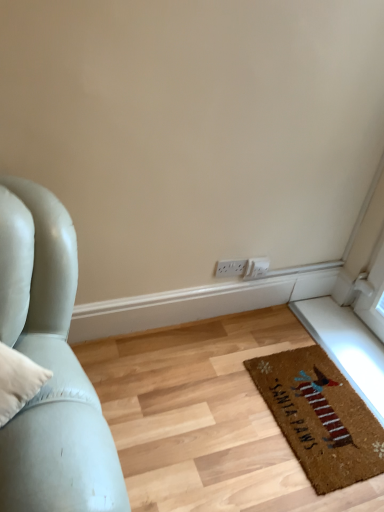
Question: Is white plastic electric outlet at center wider than brown coir mat at lower right?

Choices:
 (A) no
 (B) yes

Answer: (A)

Question: Is white plastic electric outlet at center to the right of brown coir mat at lower right from the viewer's perspective?

Choices:
 (A) no
 (B) yes

Answer: (A)

Question: Can brown coir mat at lower right be found inside white plastic electric outlet at center?

Choices:
 (A) yes
 (B) no

Answer: (B)

Question: Is white plastic electric outlet at center positioned with its back to brown coir mat at lower right?

Choices:
 (A) no
 (B) yes

Answer: (A)

Question: Does white plastic electric outlet at center have a smaller size compared to brown coir mat at lower right?

Choices:
 (A) yes
 (B) no

Answer: (A)

Question: Are white plastic electric outlet at center and brown coir mat at lower right far apart?

Choices:
 (A) no
 (B) yes

Answer: (A)

Question: Considering the relative sizes of brown coir mat at lower right and white plastic electric outlet at center in the image provided, is brown coir mat at lower right thinner than white plastic electric outlet at center?

Choices:
 (A) no
 (B) yes

Answer: (A)

Question: Does brown coir mat at lower right appear on the left side of white plastic electric outlet at center?

Choices:
 (A) no
 (B) yes

Answer: (A)

Question: From the image's perspective, is brown coir mat at lower right below white plastic electric outlet at center?

Choices:
 (A) yes
 (B) no

Answer: (A)

Question: Is white plastic electric outlet at center located within brown coir mat at lower right?

Choices:
 (A) yes
 (B) no

Answer: (B)

Question: Does brown coir mat at lower right appear on the right side of white plastic electric outlet at center?

Choices:
 (A) no
 (B) yes

Answer: (B)

Question: From a real-world perspective, is brown coir mat at lower right on top of white plastic electric outlet at center?

Choices:
 (A) no
 (B) yes

Answer: (A)

Question: Considering the positions of brown coir mat at lower right and white plastic electric outlet at center in the image, is brown coir mat at lower right wider or thinner than white plastic electric outlet at center?

Choices:
 (A) wide
 (B) thin

Answer: (A)